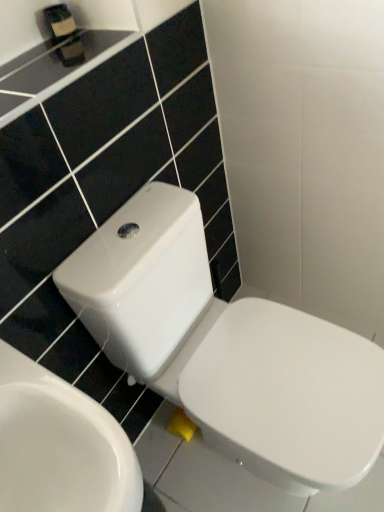
Question: Is white glossy toilet at lower right, positioned as the second toilet in right-to-left order, outside of matte black soap dispenser at upper left?

Choices:
 (A) yes
 (B) no

Answer: (A)

Question: Considering the relative sizes of white glossy toilet at lower right, placed as the 1th toilet when sorted from left to right, and matte black soap dispenser at upper left in the image provided, is white glossy toilet at lower right, placed as the 1th toilet when sorted from left to right, smaller than matte black soap dispenser at upper left?

Choices:
 (A) no
 (B) yes

Answer: (A)

Question: Is matte black soap dispenser at upper left surrounded by white glossy toilet at lower right, placed as the 1th toilet when sorted from left to right?

Choices:
 (A) yes
 (B) no

Answer: (B)

Question: From the image's perspective, is white glossy toilet at lower right, placed as the 1th toilet when sorted from left to right, below matte black soap dispenser at upper left?

Choices:
 (A) no
 (B) yes

Answer: (B)

Question: Is white glossy toilet at lower right, positioned as the second toilet in right-to-left order, turned away from matte black soap dispenser at upper left?

Choices:
 (A) no
 (B) yes

Answer: (A)

Question: Is point coord(342,353) positioned closer to the camera than point coord(11,411)?

Choices:
 (A) closer
 (B) farther

Answer: (B)

Question: Is white glossy toilet at center, the 2th toilet viewed from the left, taller or shorter than white glossy toilet at lower right, positioned as the second toilet in right-to-left order?

Choices:
 (A) short
 (B) tall

Answer: (B)

Question: Considering their positions, is white glossy toilet at center, the 2th toilet viewed from the left, located in front of or behind white glossy toilet at lower right, placed as the 1th toilet when sorted from left to right?

Choices:
 (A) front
 (B) behind

Answer: (B)

Question: From a real-world perspective, relative to white glossy toilet at lower right, positioned as the second toilet in right-to-left order, is white glossy toilet at center, placed as the first toilet when sorted from right to left, vertically above or below?

Choices:
 (A) below
 (B) above

Answer: (A)

Question: Does point click(48, 17) appear closer or farther from the camera than point click(180, 396)?

Choices:
 (A) farther
 (B) closer

Answer: (B)

Question: Is matte black soap dispenser at upper left bigger or smaller than white glossy toilet at center, placed as the first toilet when sorted from right to left?

Choices:
 (A) big
 (B) small

Answer: (B)

Question: Is matte black soap dispenser at upper left in front of or behind white glossy toilet at center, the 2th toilet viewed from the left, in the image?

Choices:
 (A) behind
 (B) front

Answer: (A)

Question: Looking at their shapes, would you say matte black soap dispenser at upper left is wider or thinner than white glossy toilet at center, the 2th toilet viewed from the left?

Choices:
 (A) thin
 (B) wide

Answer: (A)

Question: Is matte black soap dispenser at upper left to the left or to the right of white glossy toilet at lower right, placed as the 1th toilet when sorted from left to right, in the image?

Choices:
 (A) left
 (B) right

Answer: (A)

Question: From the image's perspective, is matte black soap dispenser at upper left above or below white glossy toilet at lower right, placed as the 1th toilet when sorted from left to right?

Choices:
 (A) below
 (B) above

Answer: (B)